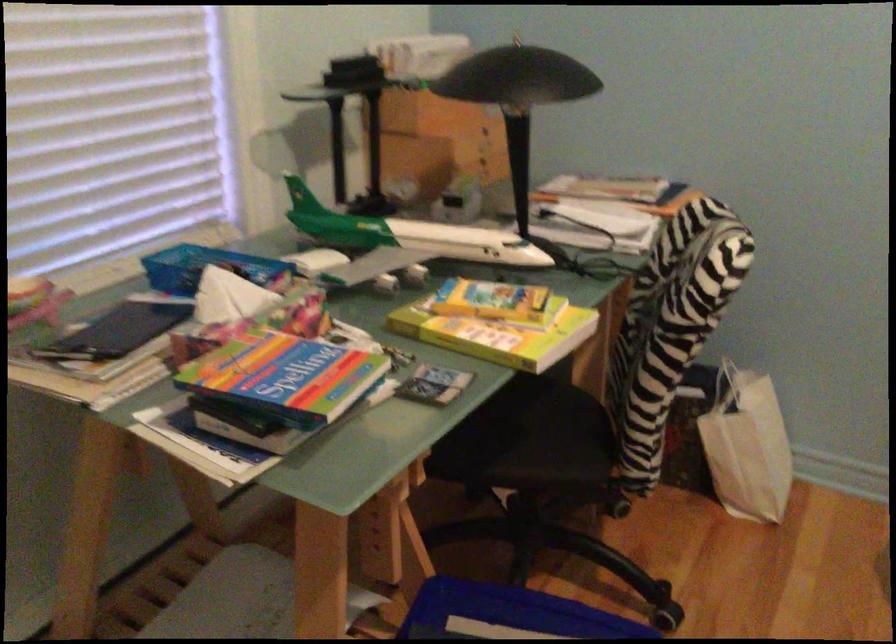
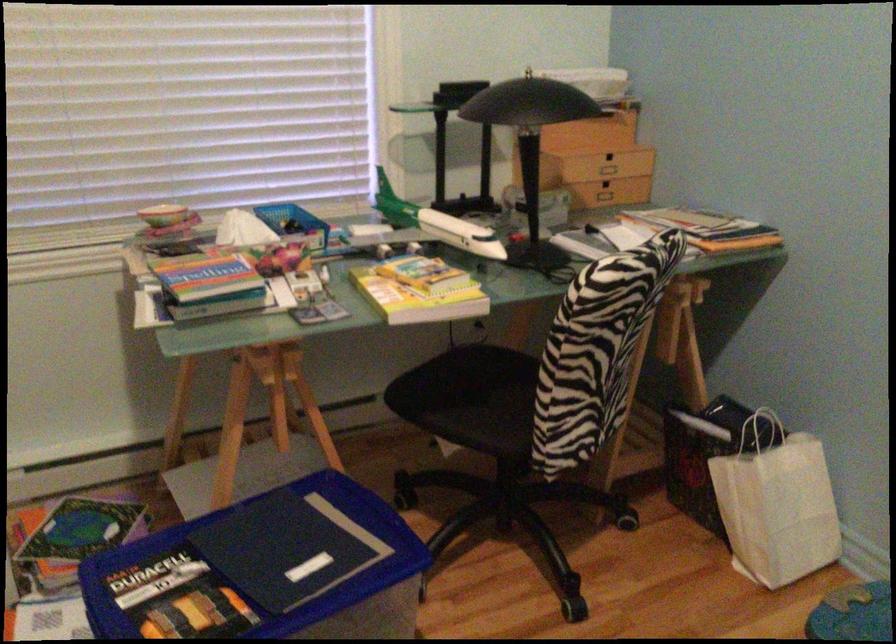
In the second image, find the point that corresponds to [518,323] in the first image.

(419, 290)